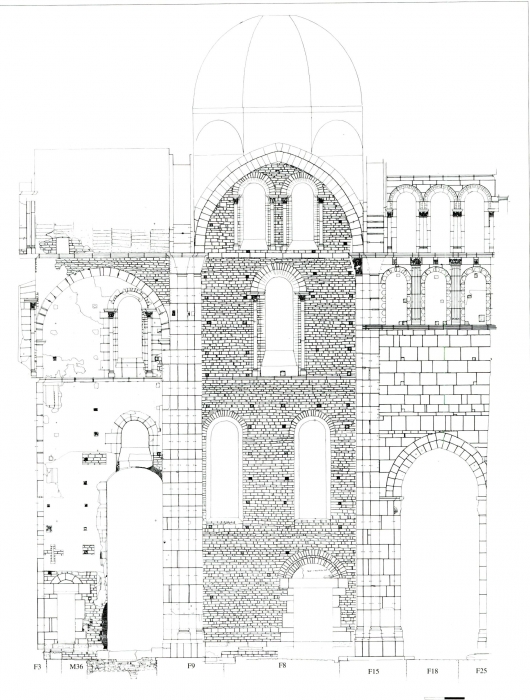
You are a GUI agent. You are given a task and a screenshot of the screen. Output one action in this format:
    pyautogui.click(x=<x>, y=<y>)
    Task: Click on the window sections
    This screenshot has height=700, width=530.
    Given the screenshot: What is the action you would take?
    pyautogui.click(x=317, y=458), pyautogui.click(x=227, y=493), pyautogui.click(x=408, y=228), pyautogui.click(x=434, y=225), pyautogui.click(x=474, y=297)